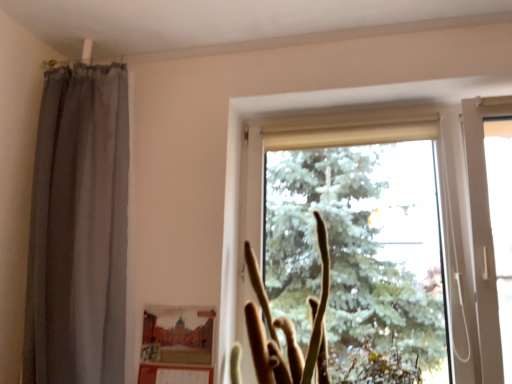
Question: From a real-world perspective, is brown fuzzy plant at center positioned over transparent glass window at center based on gravity?

Choices:
 (A) yes
 (B) no

Answer: (B)

Question: Considering the relative sizes of brown fuzzy plant at center and transparent glass window at center in the image provided, is brown fuzzy plant at center thinner than transparent glass window at center?

Choices:
 (A) no
 (B) yes

Answer: (A)

Question: Is brown fuzzy plant at center outside transparent glass window at center?

Choices:
 (A) yes
 (B) no

Answer: (A)

Question: From the image's perspective, is brown fuzzy plant at center under transparent glass window at center?

Choices:
 (A) no
 (B) yes

Answer: (B)

Question: Could you tell me if brown fuzzy plant at center is turned towards transparent glass window at center?

Choices:
 (A) no
 (B) yes

Answer: (A)

Question: Can you confirm if brown fuzzy plant at center is taller than transparent glass window at center?

Choices:
 (A) no
 (B) yes

Answer: (A)

Question: Are brown fuzzy plant at center and matte cardboard picture frame at lower center beside each other?

Choices:
 (A) no
 (B) yes

Answer: (A)

Question: Does brown fuzzy plant at center turn towards matte cardboard picture frame at lower center?

Choices:
 (A) no
 (B) yes

Answer: (A)

Question: Is brown fuzzy plant at center outside matte cardboard picture frame at lower center?

Choices:
 (A) yes
 (B) no

Answer: (A)

Question: From a real-world perspective, is brown fuzzy plant at center over matte cardboard picture frame at lower center?

Choices:
 (A) yes
 (B) no

Answer: (A)

Question: From the image's perspective, is brown fuzzy plant at center below matte cardboard picture frame at lower center?

Choices:
 (A) no
 (B) yes

Answer: (A)

Question: From a real-world perspective, is brown fuzzy plant at center under matte cardboard picture frame at lower center?

Choices:
 (A) no
 (B) yes

Answer: (A)

Question: From the image's perspective, does matte cardboard picture frame at lower center appear higher than transparent glass window at center?

Choices:
 (A) yes
 (B) no

Answer: (B)